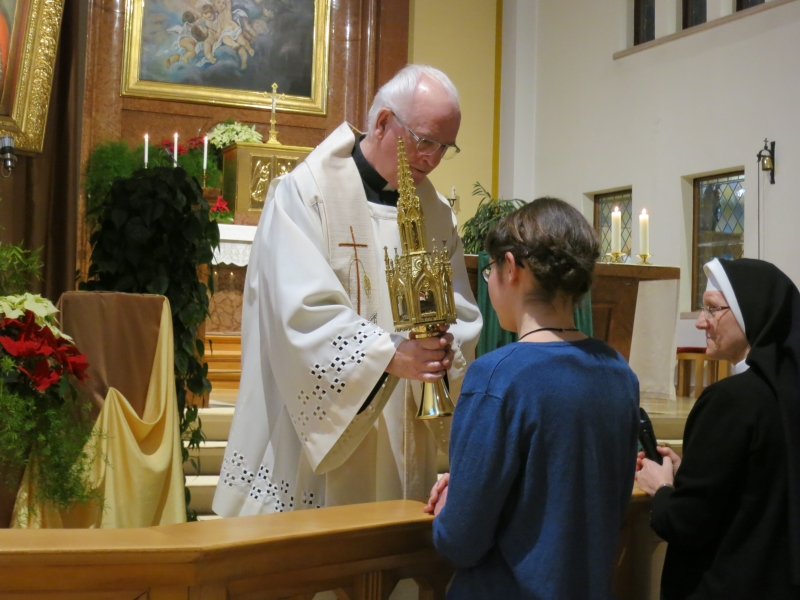
The image size is (800, 600). In order to click on candles in this screenshot , I will do `click(638, 230)`, `click(614, 229)`, `click(206, 160)`, `click(176, 159)`, `click(150, 152)`, `click(274, 118)`.